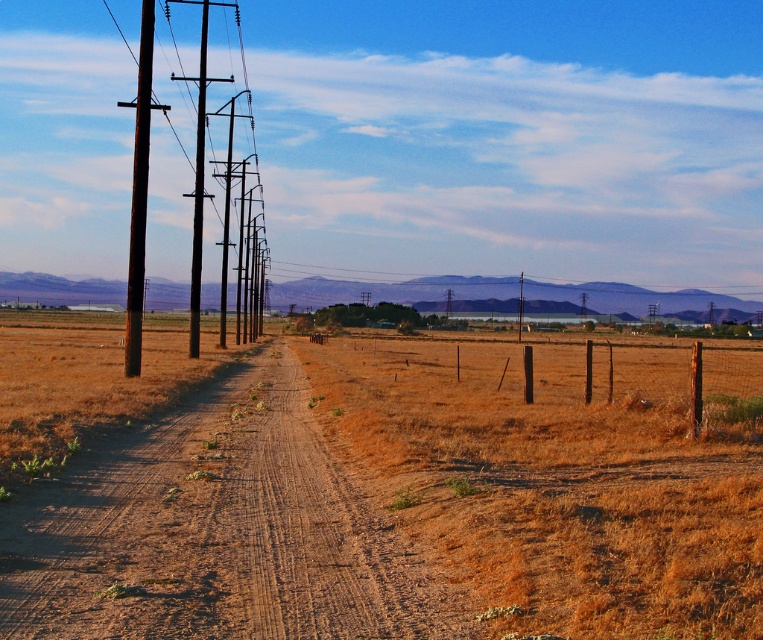
You are standing at the starting point of the dirt road in the rural landscape. You see two points marked on the ground ahead of you. The first point is labeled as point (324, 362), and the second is point (285, 296). Which point is closer to you as you face the direction the road is going?

Point (324, 362) is in front of point (285, 296), so the first point is closer to you as you face the direction the road is going.